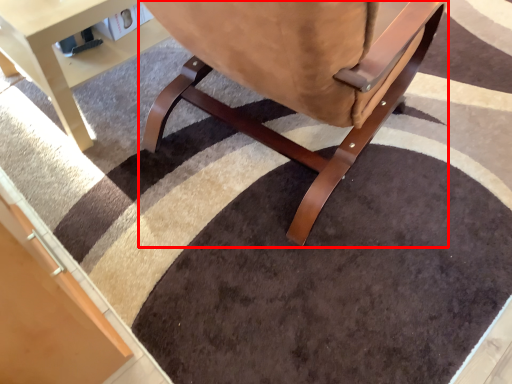
Question: From the image's perspective, what is the correct spatial relationship of chair (annotated by the red box) in relation to table?

Choices:
 (A) above
 (B) below

Answer: (B)